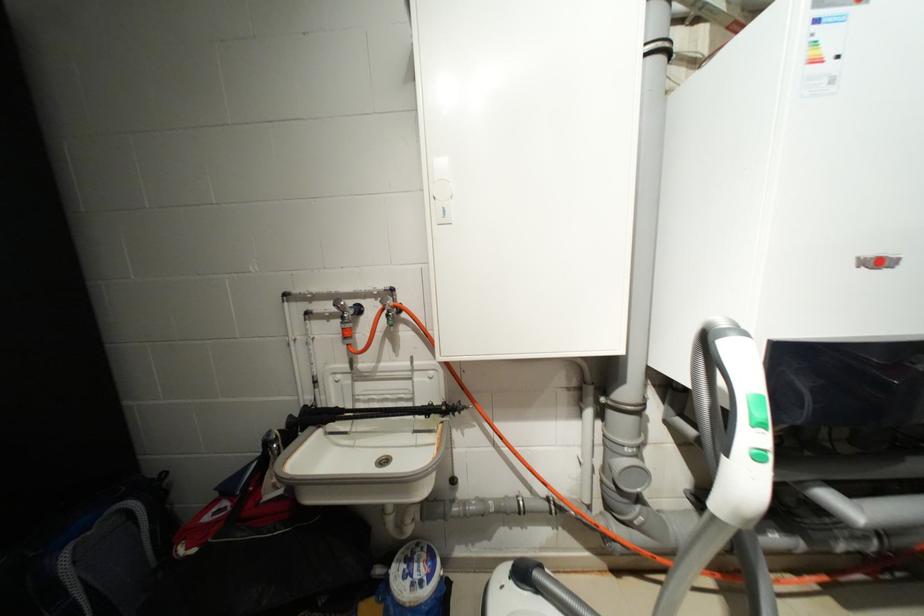
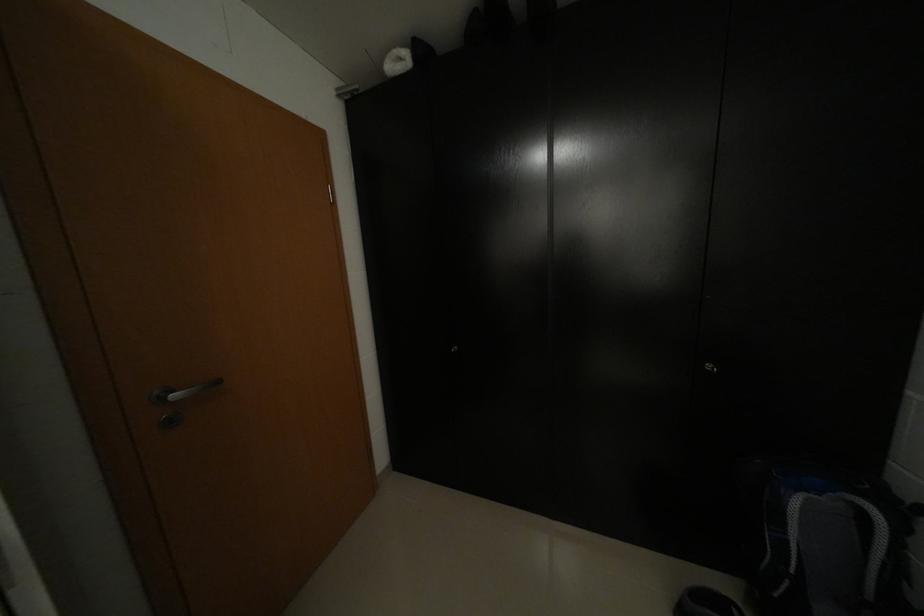
Find the pixel in the second image that matches [128,500] in the first image.

(867, 495)